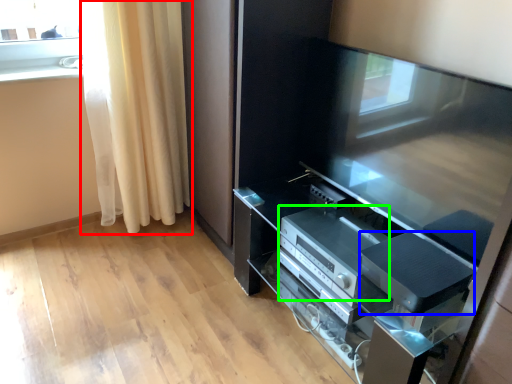
Question: Which is farther away from curtain (highlighted by a red box)? appliance (highlighted by a blue box) or appliance (highlighted by a green box)?

Choices:
 (A) appliance
 (B) appliance

Answer: (A)